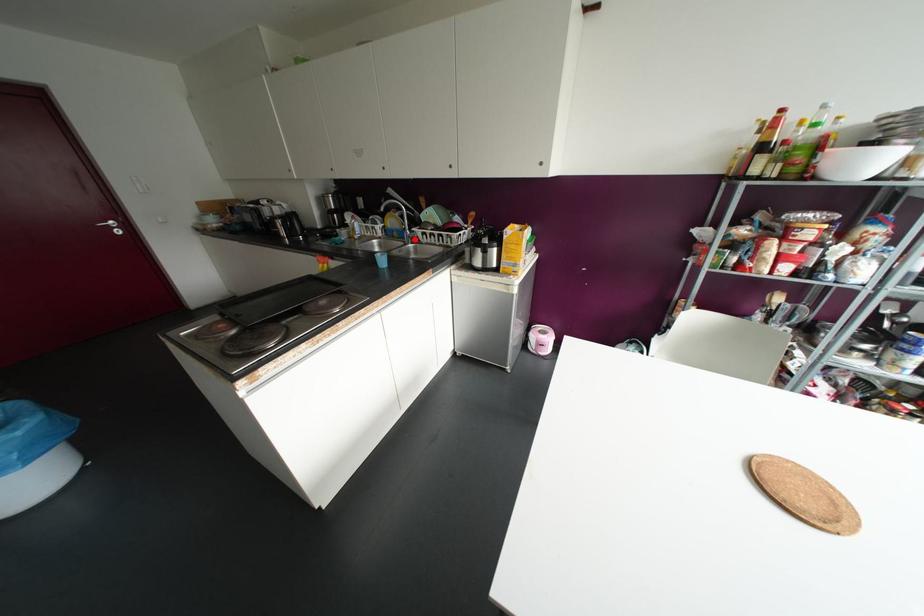
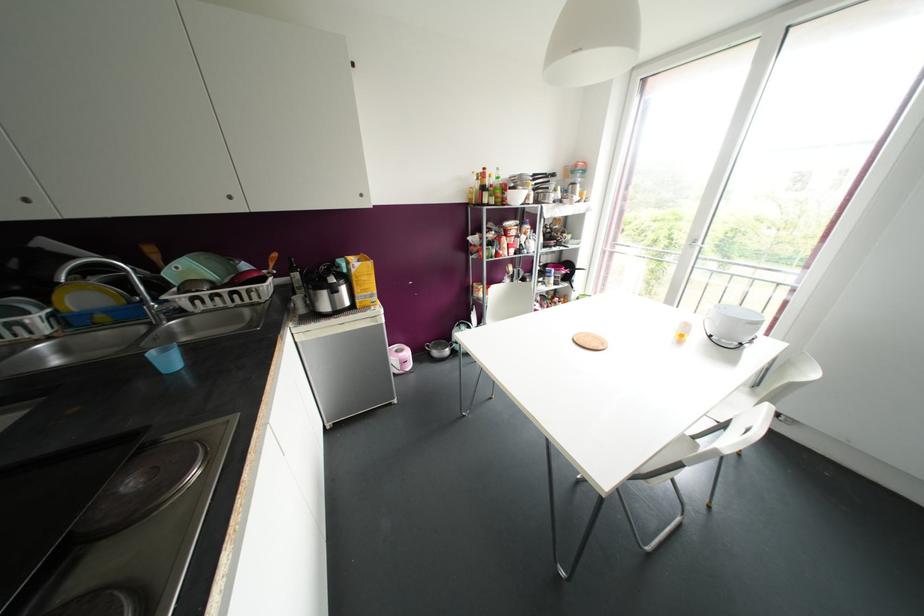
Locate, in the second image, the point that corresponds to the highlighted location in the first image.

(178, 312)